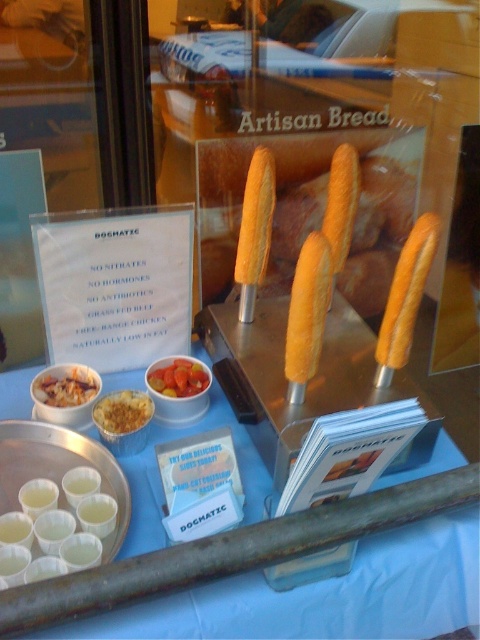
Is blue fabric table at center below golden breadstick at center?

Yes, blue fabric table at center is below golden breadstick at center.

Does blue fabric table at center have a greater width compared to golden breadstick at center?

Yes.

You are a GUI agent. You are given a task and a screenshot of the screen. Output one action in this format:
    pyautogui.click(x=<x>, y=<y>)
    Task: Click on the blue fabric table at center
    
    Given the screenshot: What is the action you would take?
    pyautogui.click(x=324, y=595)

Which is below, golden-brown crusty bread at center or vibrant orange carrot at center?

vibrant orange carrot at center is lower down.

Which is above, golden-brown crusty bread at center or vibrant orange carrot at center?

golden-brown crusty bread at center

Who is more distant from viewer, (402, 336) or (175, 396)?

The point (175, 396) is behind.

Find the location of `golden-brown crusty bread at center`. golden-brown crusty bread at center is located at coordinates (407, 292).

Is golden crispy breadstick at center thinner than matte brown rice at center left?

Indeed, golden crispy breadstick at center has a lesser width compared to matte brown rice at center left.

Between golden crispy breadstick at center and matte brown rice at center left, which one appears on the left side from the viewer's perspective?

Positioned to the left is matte brown rice at center left.

You are a GUI agent. You are given a task and a screenshot of the screen. Output one action in this format:
    pyautogui.click(x=<x>, y=<y>)
    Task: Click on the golden crispy breadstick at center
    This screenshot has height=640, width=480.
    Given the screenshot: What is the action you would take?
    pyautogui.click(x=255, y=220)